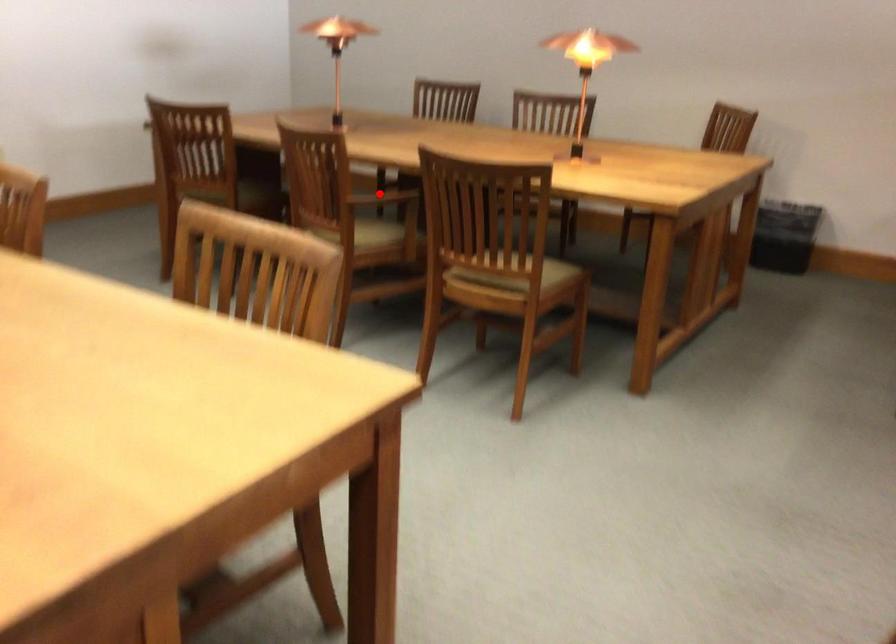
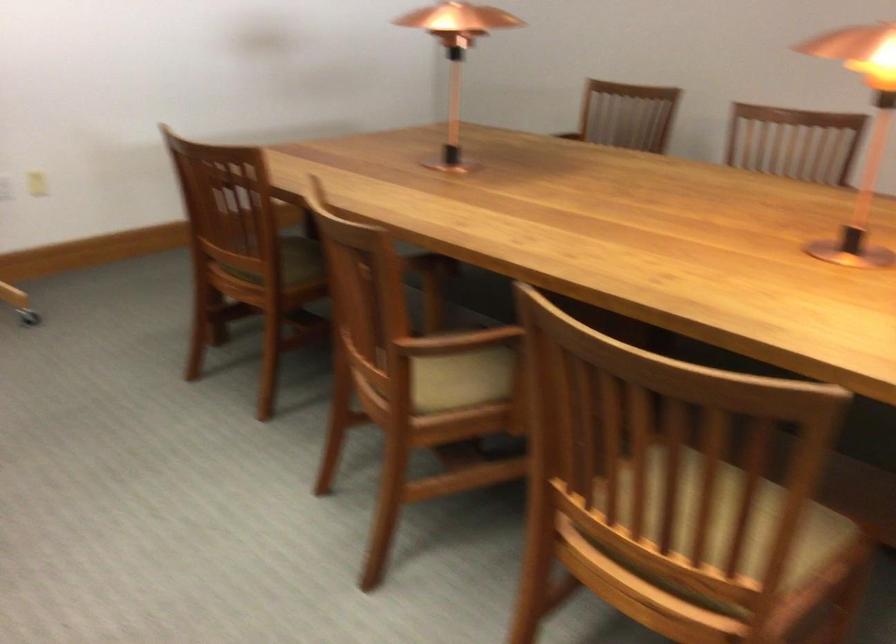
Question: I am providing you with two images of the same scene from different viewpoints. A red point is marked on the first image. Can you still see the location of the red point in image 2?

Choices:
 (A) Yes
 (B) No

Answer: (A)